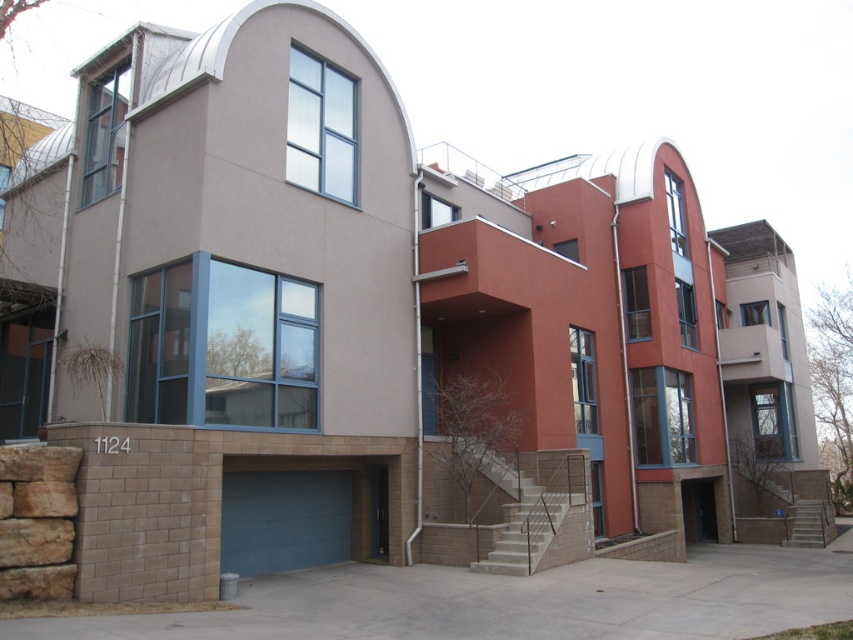
Question: Is the position of white concrete stairs at center less distant than that of smooth concrete stairs at lower right?

Choices:
 (A) yes
 (B) no

Answer: (A)

Question: Does white concrete stairs at center have a lesser width compared to smooth concrete stairs at lower right?

Choices:
 (A) no
 (B) yes

Answer: (A)

Question: Does white concrete stairs at center appear on the left side of smooth concrete stairs at lower right?

Choices:
 (A) no
 (B) yes

Answer: (B)

Question: Based on their relative distances, which object is nearer to the white concrete stairs at center?

Choices:
 (A) blue matte garage door at lower left
 (B) smooth concrete stairs at lower right

Answer: (A)

Question: Which of the following is the closest to the observer?

Choices:
 (A) white concrete stairs at center
 (B) blue matte garage door at lower left
 (C) smooth concrete stairs at lower right

Answer: (B)

Question: Which object is closer to the camera taking this photo?

Choices:
 (A) blue matte garage door at lower left
 (B) smooth concrete stairs at lower right
 (C) white concrete stairs at center

Answer: (A)